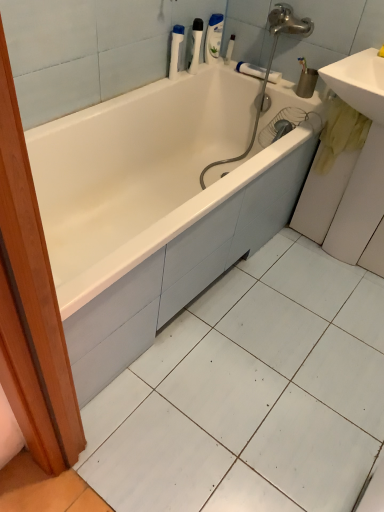
Question: Does white plastic bottle at upper center, acting as the 2th toiletry starting from the left, have a greater width compared to white glossy bathtub at center?

Choices:
 (A) yes
 (B) no

Answer: (B)

Question: Considering the relative positions of white plastic bottle at upper center, acting as the 2th toiletry starting from the left, and white glossy bathtub at center in the image provided, is white plastic bottle at upper center, acting as the 2th toiletry starting from the left, to the left of white glossy bathtub at center from the viewer's perspective?

Choices:
 (A) no
 (B) yes

Answer: (A)

Question: Can you confirm if white plastic bottle at upper center, acting as the 2th toiletry starting from the left, is thinner than white glossy bathtub at center?

Choices:
 (A) no
 (B) yes

Answer: (B)

Question: Can you confirm if white plastic bottle at upper center, placed as the first toiletry when sorted from back to front, is smaller than white glossy bathtub at center?

Choices:
 (A) yes
 (B) no

Answer: (A)

Question: Is white plastic bottle at upper center, the second toiletry in the front-to-back sequence, looking in the opposite direction of white glossy bathtub at center?

Choices:
 (A) yes
 (B) no

Answer: (B)

Question: Are white plastic bottle at upper center, marked as the first toiletry in a right-to-left arrangement, and white glossy bathtub at center beside each other?

Choices:
 (A) no
 (B) yes

Answer: (A)

Question: Is white plastic bottle at upper center, acting as the 2th toiletry starting from the left, next to white glossy sink at upper right, the second sink from the bottom, and touching it?

Choices:
 (A) yes
 (B) no

Answer: (B)

Question: Does white plastic bottle at upper center, the second toiletry in the front-to-back sequence, have a greater height compared to white glossy sink at upper right, the second sink from the bottom?

Choices:
 (A) no
 (B) yes

Answer: (A)

Question: Is white glossy sink at upper right, which is counted as the first sink, starting from the top, surrounded by white plastic bottle at upper center, marked as the first toiletry in a right-to-left arrangement?

Choices:
 (A) yes
 (B) no

Answer: (B)

Question: Is white plastic bottle at upper center, acting as the 2th toiletry starting from the left, at the left side of white glossy sink at upper right, which is counted as the first sink, starting from the top?

Choices:
 (A) yes
 (B) no

Answer: (A)

Question: Can you confirm if white plastic bottle at upper center, placed as the first toiletry when sorted from back to front, is wider than white glossy sink at upper right, which is counted as the first sink, starting from the top?

Choices:
 (A) no
 (B) yes

Answer: (A)

Question: Does white plastic bottle at upper center, marked as the first toiletry in a right-to-left arrangement, lie in front of white glossy sink at upper right, the second sink from the bottom?

Choices:
 (A) no
 (B) yes

Answer: (A)

Question: Would you say white glossy sink at upper right, the second sink from the bottom, is part of white glossy sink at right, which ranks as the 1th sink in bottom-to-top order,'s contents?

Choices:
 (A) no
 (B) yes

Answer: (A)